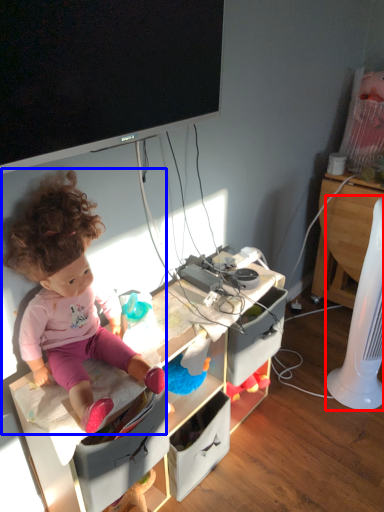
Question: Which object is closer to the camera taking this photo, fan (highlighted by a red box) or person (highlighted by a blue box)?

Choices:
 (A) fan
 (B) person

Answer: (B)